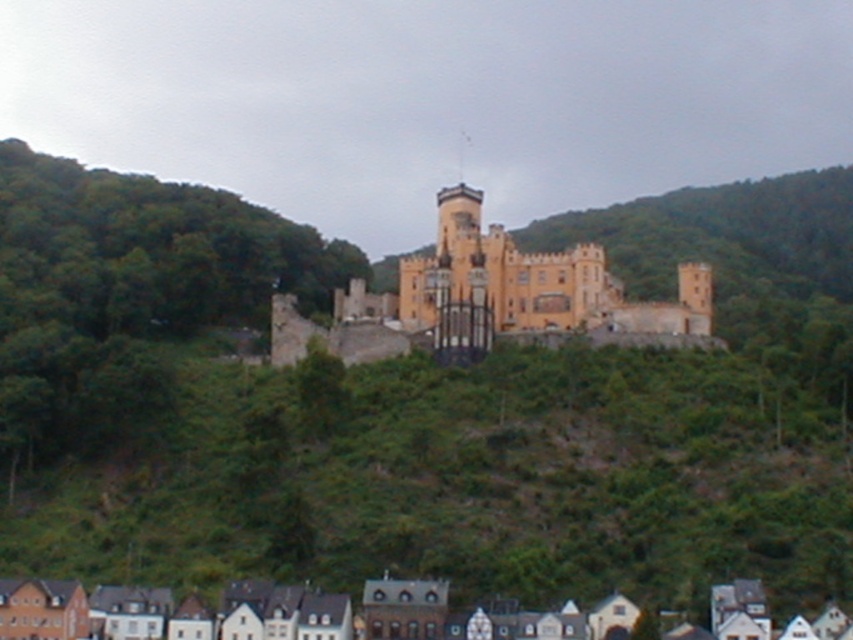
You are standing at the base of the hill and looking up towards the matte orange stone castle at center and the white painted wood houses at lower center. Which structure is higher in your field of view?

The matte orange stone castle at center is positioned over the white painted wood houses at lower center, so it appears higher in your field of view.

You are standing at the base of the hill and see the point at coordinates [494,300]. What object is located at that point?

The point at coordinates [494,300] corresponds to the matte orange stone castle at center.

You are standing in the field looking at the matte orange stone castle at center and the white painted wood houses at lower center. Which structure is closer to you?

The matte orange stone castle at center is closer to you than the white painted wood houses at lower center.